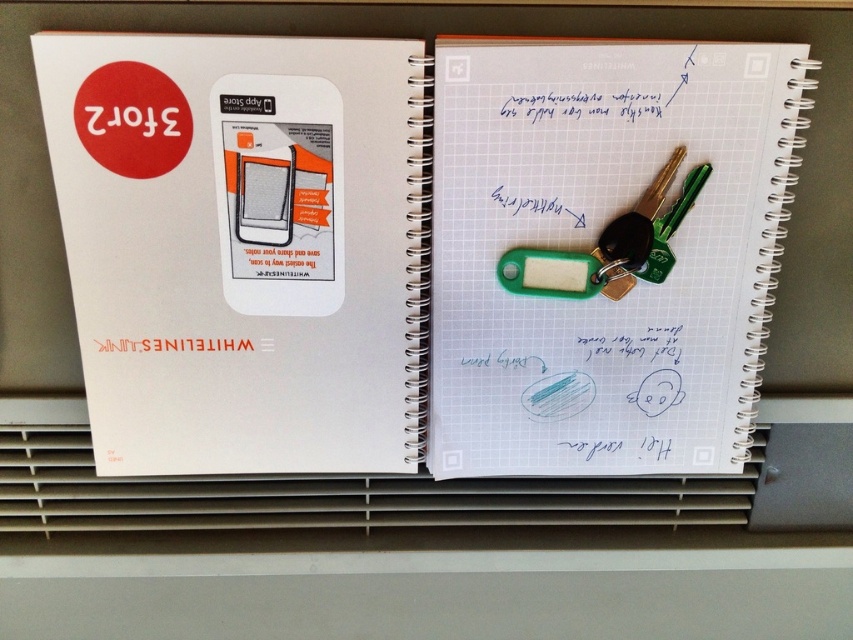
Question: Is white matte notebook at center behind white grid paper at center?

Choices:
 (A) yes
 (B) no

Answer: (B)

Question: Does white matte notebook at center have a smaller size compared to white grid paper at center?

Choices:
 (A) yes
 (B) no

Answer: (B)

Question: Is white matte notebook at center closer to the viewer compared to green plastic keychain at center?

Choices:
 (A) no
 (B) yes

Answer: (B)

Question: Which object is the closest to the white matte notebook at center?

Choices:
 (A) green plastic keychain at center
 (B) white grid paper at center

Answer: (B)

Question: Which point is closer to the camera?

Choices:
 (A) (611, 161)
 (B) (85, 160)
 (C) (679, 150)

Answer: (B)

Question: Which point appears farthest from the camera in this image?

Choices:
 (A) (628, 252)
 (B) (206, 449)
 (C) (672, 256)

Answer: (B)